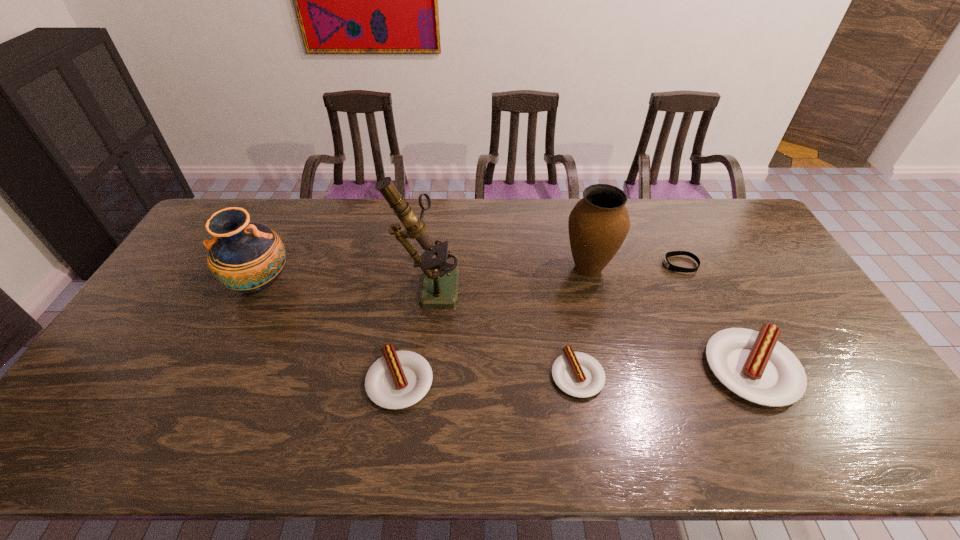
This screenshot has height=540, width=960. Identify the location of empty location between the wristband and the pottery. (470, 274).

Locate an element on the screen. free space between the wristband and the pottery is located at coordinates (470, 274).

You are a GUI agent. You are given a task and a screenshot of the screen. Output one action in this format:
    pyautogui.click(x=<x>, y=<y>)
    Task: Click on the blank region between the second shortest object and the shortest object
    The image size is (960, 540).
    Given the screenshot: What is the action you would take?
    pyautogui.click(x=629, y=320)

Find the location of `object that ranks as the third closest to the third shortest object`. object that ranks as the third closest to the third shortest object is located at coordinates (248, 257).

Identify which object is located as the sixth nearest to the microscope. Please provide its 2D coordinates. Your answer should be formatted as a tuple, i.e. [(x, y)], where the tuple contains the x and y coordinates of a point satisfying the conditions above.

[(754, 365)]

At what (x,y) coordinates should I click in order to perform the action: click on sausage that can be found as the third closest to the leftmost object. Please return your answer as a coordinate pair (x, y). The image size is (960, 540). Looking at the image, I should click on (754, 365).

Locate an element on the screen. The width and height of the screenshot is (960, 540). sausage that stands as the second closest to the fifth tallest object is located at coordinates (754, 365).

This screenshot has height=540, width=960. I want to click on vacant area that satisfies the following two spatial constraints: 1. on the display of the shortest object; 2. on the right side of the fourth tallest object, so click(x=730, y=369).

This screenshot has height=540, width=960. I want to click on vacant region that satisfies the following two spatial constraints: 1. at the eyepiece of the second sausage from left to right; 2. on the right side of the tallest object, so click(417, 375).

Find the location of a particular element. free spot that satisfies the following two spatial constraints: 1. on the display of the wristband; 2. on the front side of the second tallest sausage is located at coordinates (734, 381).